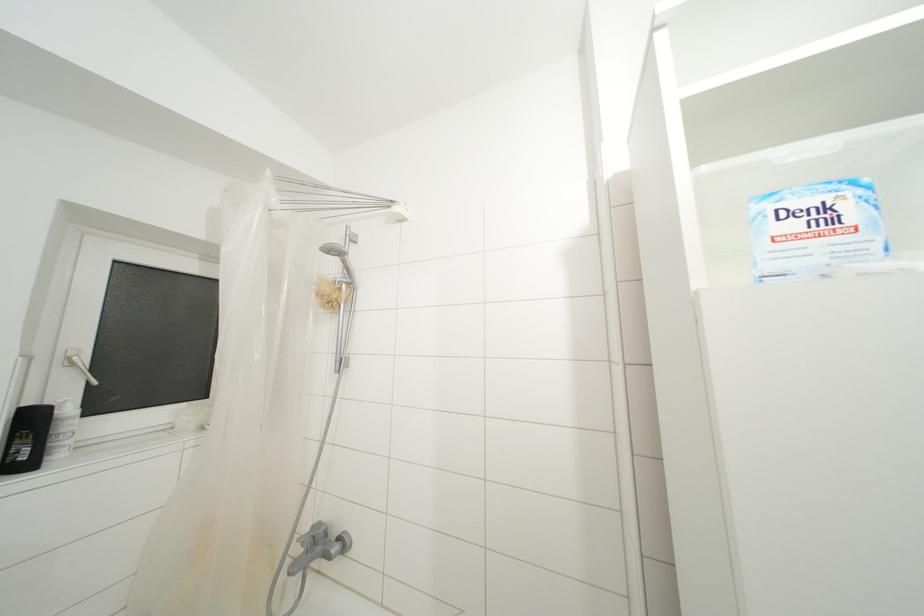
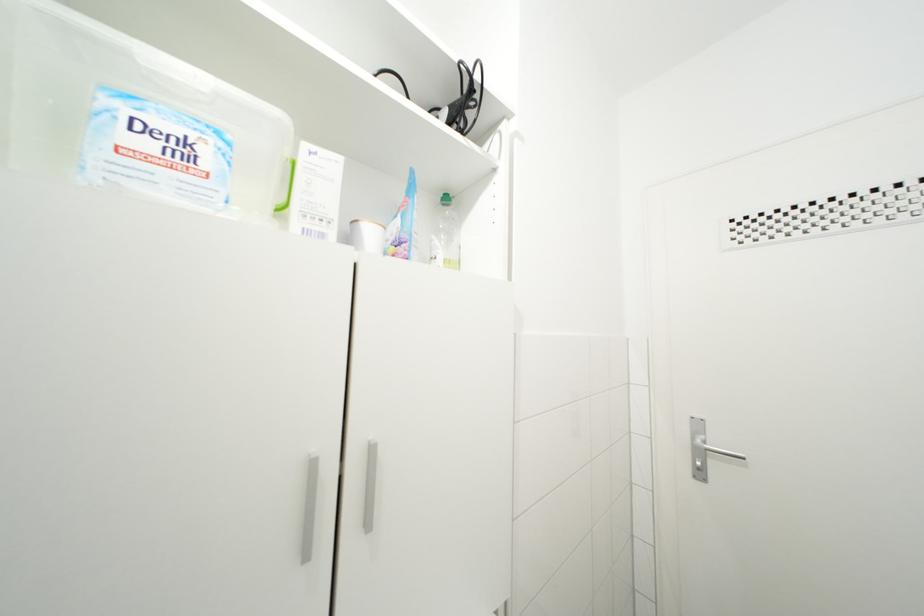
Question: The camera is either moving clockwise (left) or counter-clockwise (right) around the object. The first image is from the beginning of the video and the second image is from the end. Is the camera moving left or right when shooting the video?

Choices:
 (A) Left
 (B) Right

Answer: (A)